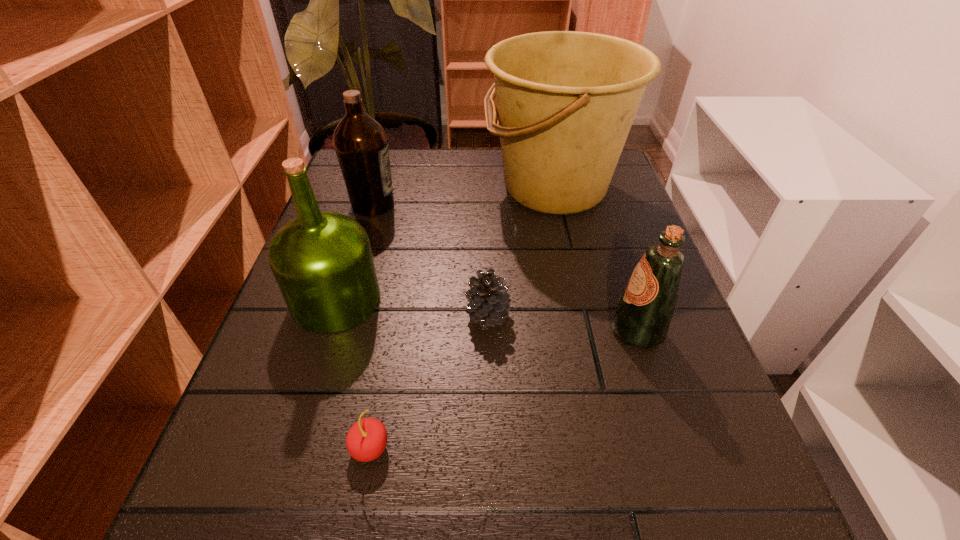
Find the location of `free region located on the label of the farthest olive oil`. free region located on the label of the farthest olive oil is located at coordinates (564, 205).

Where is `free space located 0.270m on the front-facing side of the third shortest object`? This screenshot has height=540, width=960. free space located 0.270m on the front-facing side of the third shortest object is located at coordinates (453, 332).

Image resolution: width=960 pixels, height=540 pixels. What are the coordinates of `vacant space situated 0.350m on the front-facing side of the third shortest object` in the screenshot? It's located at (407, 332).

Where is `vacant space located 0.090m on the front-facing side of the third shortest object`? This screenshot has width=960, height=540. vacant space located 0.090m on the front-facing side of the third shortest object is located at coordinates (558, 332).

Image resolution: width=960 pixels, height=540 pixels. Find the location of `free space located on the back of the pinecone`. free space located on the back of the pinecone is located at coordinates (486, 207).

Where is `free space located on the front of the third object from left to right`? free space located on the front of the third object from left to right is located at coordinates (354, 535).

Image resolution: width=960 pixels, height=540 pixels. Identify the location of bucket situated at the far edge. (566, 100).

Locate an element on the screen. The width and height of the screenshot is (960, 540). olive oil that is at the far edge is located at coordinates (361, 145).

The height and width of the screenshot is (540, 960). In order to click on bucket present at the right edge in this screenshot , I will do `click(566, 100)`.

At what (x,y) coordinates should I click in order to perform the action: click on olive oil at the right edge. Please return your answer as a coordinate pair (x, y). Looking at the image, I should click on (643, 316).